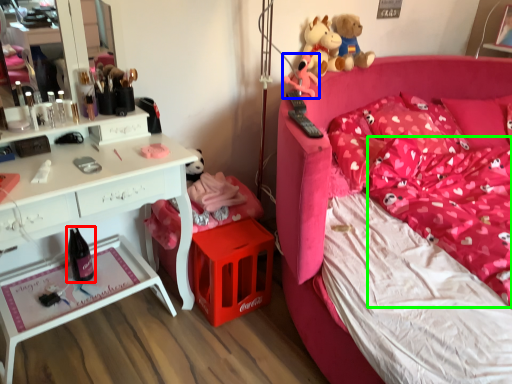
Question: Estimate the real-world distances between objects in this image. Which object is farther from wine bottle (highlighted by a red box), toy (highlighted by a blue box) or mattress (highlighted by a green box)?

Choices:
 (A) toy
 (B) mattress

Answer: (B)